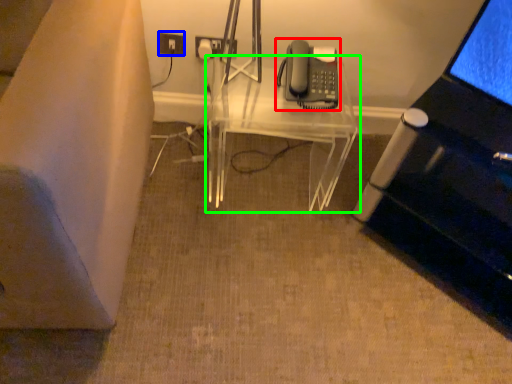
Question: Which object is positioned farthest from corded phone (highlighted by a red box)? Select from electric outlet (highlighted by a blue box) and table (highlighted by a green box).

Choices:
 (A) electric outlet
 (B) table

Answer: (A)